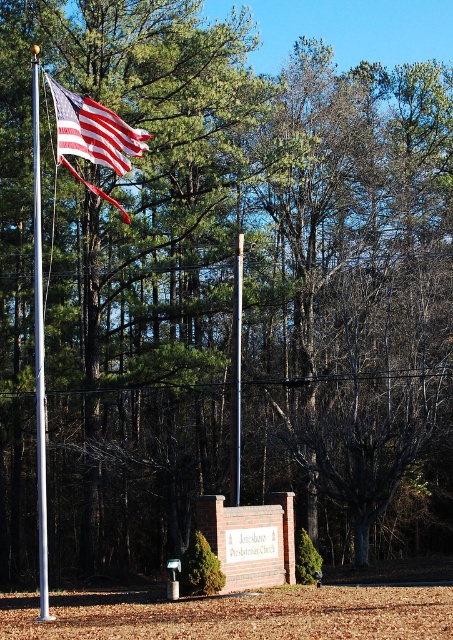
Is the position of american flag at left more distant than that of polished metal flag pole at left?

That is True.

What do you see at coordinates (94, 131) in the screenshot?
I see `american flag at left` at bounding box center [94, 131].

This screenshot has width=453, height=640. Identify the location of american flag at left. (94, 131).